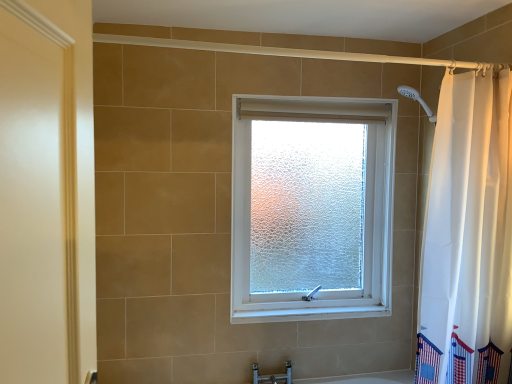
Question: Considering the relative positions of frosted glass window at center and white fabric curtain at right in the image provided, is frosted glass window at center in front of white fabric curtain at right?

Choices:
 (A) no
 (B) yes

Answer: (A)

Question: Considering the relative positions of frosted glass window at center and white fabric curtain at right in the image provided, is frosted glass window at center to the right of white fabric curtain at right from the viewer's perspective?

Choices:
 (A) no
 (B) yes

Answer: (A)

Question: From the image's perspective, is frosted glass window at center beneath white fabric curtain at right?

Choices:
 (A) no
 (B) yes

Answer: (B)

Question: Is frosted glass window at center facing towards white fabric curtain at right?

Choices:
 (A) yes
 (B) no

Answer: (A)

Question: Is frosted glass window at center shorter than white fabric curtain at right?

Choices:
 (A) no
 (B) yes

Answer: (A)

Question: From the image's perspective, relative to matte silver faucet at lower center, is frosted glass window at center above or below?

Choices:
 (A) above
 (B) below

Answer: (A)

Question: From a real-world perspective, is frosted glass window at center positioned above or below matte silver faucet at lower center?

Choices:
 (A) below
 (B) above

Answer: (B)

Question: Is frosted glass window at center spatially inside matte silver faucet at lower center, or outside of it?

Choices:
 (A) inside
 (B) outside

Answer: (B)

Question: Is frosted glass window at center taller or shorter than matte silver faucet at lower center?

Choices:
 (A) tall
 (B) short

Answer: (A)

Question: From a real-world perspective, is frosted glass window at center positioned above or below white fabric curtain at right?

Choices:
 (A) above
 (B) below

Answer: (B)

Question: Relative to white fabric curtain at right, is frosted glass window at center in front or behind?

Choices:
 (A) behind
 (B) front

Answer: (A)

Question: Based on their positions, is frosted glass window at center located to the left or right of white fabric curtain at right?

Choices:
 (A) left
 (B) right

Answer: (A)

Question: Is frosted glass window at center bigger or smaller than white fabric curtain at right?

Choices:
 (A) big
 (B) small

Answer: (A)

Question: In the image, is matte silver faucet at lower center on the left side or the right side of white fabric curtain at right?

Choices:
 (A) right
 (B) left

Answer: (B)

Question: From a real-world perspective, is matte silver faucet at lower center above or below white fabric curtain at right?

Choices:
 (A) below
 (B) above

Answer: (A)